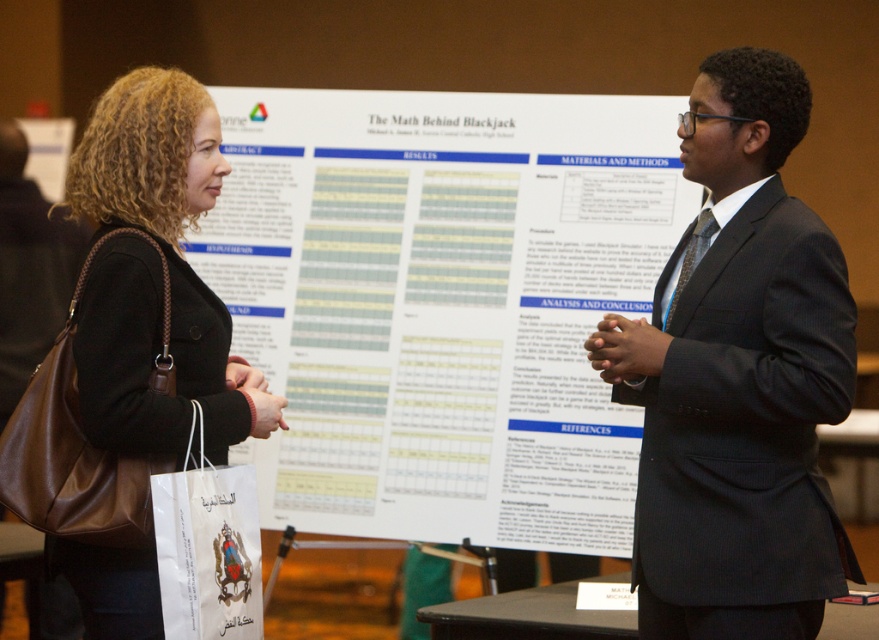
Question: Among these points, which one is nearest to the camera?

Choices:
 (A) (830, 337)
 (B) (572, 508)
 (C) (40, 196)

Answer: (A)

Question: Can you confirm if dark gray suit at center is thinner than brown leather bag at left?

Choices:
 (A) no
 (B) yes

Answer: (A)

Question: Is white paper poster at center below dark gray suit at center?

Choices:
 (A) no
 (B) yes

Answer: (A)

Question: Which object is farther from the camera taking this photo?

Choices:
 (A) black leather bag at left
 (B) white paper poster at center
 (C) brown leather bag at left
 (D) dark gray suit at center

Answer: (C)

Question: Can you confirm if black leather bag at left is smaller than brown leather bag at left?

Choices:
 (A) yes
 (B) no

Answer: (B)

Question: Which object is closer to the camera taking this photo?

Choices:
 (A) white paper poster at center
 (B) brown leather bag at left

Answer: (A)